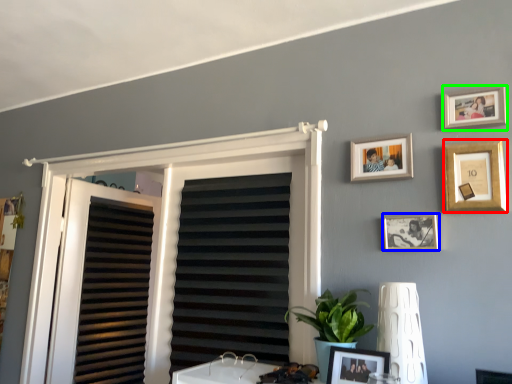
Question: Which is nearer to the picture frame (highlighted by a red box)? picture frame (highlighted by a blue box) or picture frame (highlighted by a green box).

Choices:
 (A) picture frame
 (B) picture frame

Answer: (B)